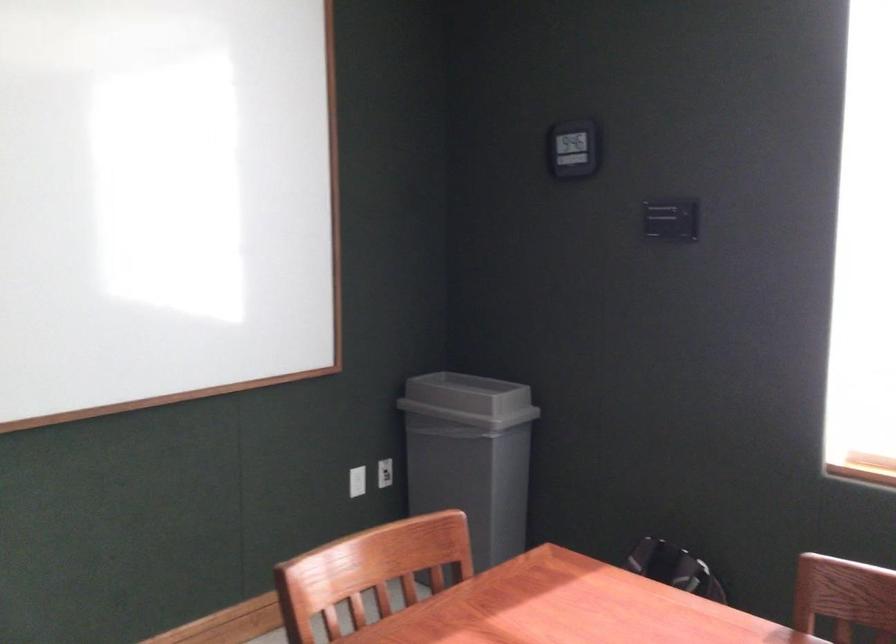
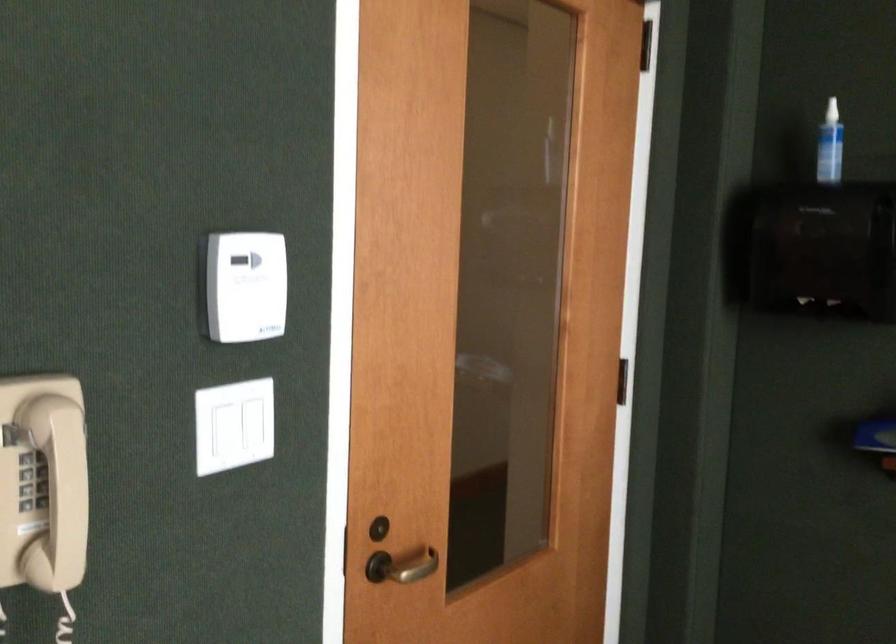
Question: How did the camera likely rotate?

Choices:
 (A) Left
 (B) Right
 (C) Up
 (D) Down

Answer: (A)